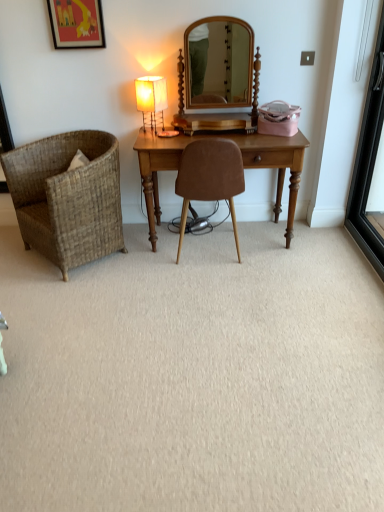
Question: Can you confirm if matte fabric table lamp at center is bigger than black glass screen door at right?

Choices:
 (A) no
 (B) yes

Answer: (A)

Question: Does matte fabric table lamp at center appear on the right side of black glass screen door at right?

Choices:
 (A) yes
 (B) no

Answer: (B)

Question: Is matte fabric table lamp at center shorter than black glass screen door at right?

Choices:
 (A) yes
 (B) no

Answer: (A)

Question: Does matte fabric table lamp at center lie in front of black glass screen door at right?

Choices:
 (A) yes
 (B) no

Answer: (B)

Question: Are matte fabric table lamp at center and black glass screen door at right beside each other?

Choices:
 (A) yes
 (B) no

Answer: (B)

Question: Is point (375, 139) closer or farther from the camera than point (54, 17)?

Choices:
 (A) farther
 (B) closer

Answer: (A)

Question: In terms of width, does black glass screen door at right look wider or thinner when compared to matte black picture frame at upper left?

Choices:
 (A) thin
 (B) wide

Answer: (B)

Question: Visually, is black glass screen door at right positioned to the left or to the right of matte black picture frame at upper left?

Choices:
 (A) right
 (B) left

Answer: (A)

Question: From the image's perspective, is black glass screen door at right located above or below matte black picture frame at upper left?

Choices:
 (A) below
 (B) above

Answer: (A)

Question: Considering their positions, is woven brown chair at left, marked as the 1th chair in a left-to-right arrangement, located in front of or behind black glass screen door at right?

Choices:
 (A) behind
 (B) front

Answer: (A)

Question: From a real-world perspective, relative to black glass screen door at right, is woven brown chair at left, arranged as the second chair when viewed from the right, vertically above or below?

Choices:
 (A) above
 (B) below

Answer: (B)

Question: In the image, is woven brown chair at left, arranged as the second chair when viewed from the right, on the left side or the right side of black glass screen door at right?

Choices:
 (A) right
 (B) left

Answer: (B)

Question: Is point (66, 254) closer or farther from the camera than point (377, 114)?

Choices:
 (A) closer
 (B) farther

Answer: (A)

Question: From a real-world perspective, is brown suede chair at center, which is counted as the 2th chair, starting from the left, physically located above or below matte black picture frame at upper left?

Choices:
 (A) below
 (B) above

Answer: (A)

Question: Considering the relative positions of brown suede chair at center, marked as the first chair in a right-to-left arrangement, and matte black picture frame at upper left in the image provided, is brown suede chair at center, marked as the first chair in a right-to-left arrangement, to the left or to the right of matte black picture frame at upper left?

Choices:
 (A) left
 (B) right

Answer: (B)